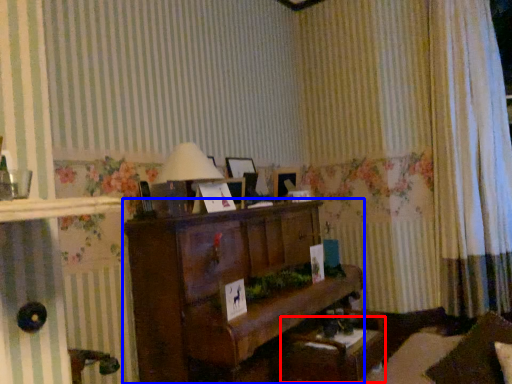
Question: Which of the following is the closest to the observer, table (highlighted by a red box) or furniture (highlighted by a blue box)?

Choices:
 (A) table
 (B) furniture

Answer: (B)